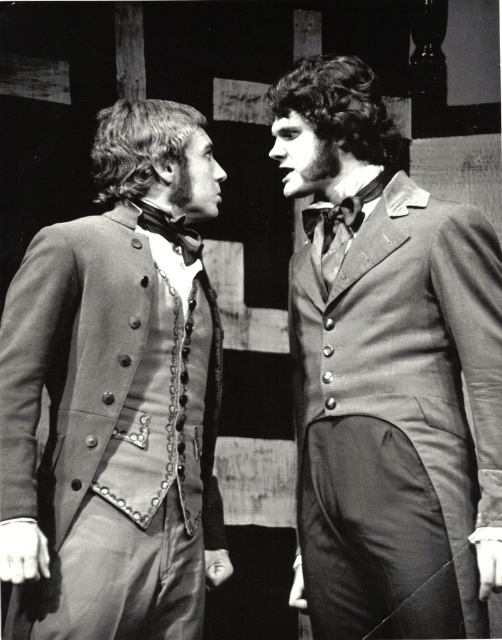
Question: Which object is farther from the camera taking this photo?

Choices:
 (A) smooth gray suit at center
 (B) smooth gray coat at left

Answer: (B)

Question: Among these objects, which one is farthest from the camera?

Choices:
 (A) smooth gray coat at left
 (B) smooth gray suit at center

Answer: (A)

Question: Is smooth gray suit at center closer to camera compared to smooth gray coat at left?

Choices:
 (A) no
 (B) yes

Answer: (B)

Question: Is smooth gray suit at center positioned before smooth gray coat at left?

Choices:
 (A) no
 (B) yes

Answer: (B)

Question: Can you confirm if smooth gray suit at center is positioned above smooth gray coat at left?

Choices:
 (A) no
 (B) yes

Answer: (B)